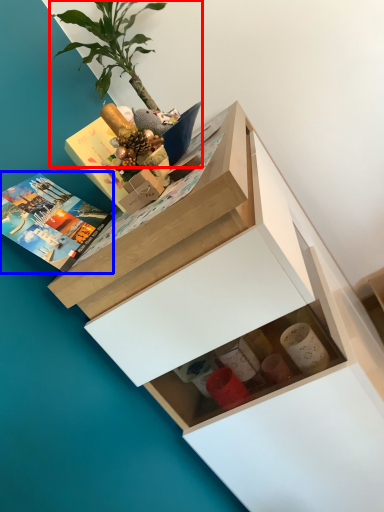
Question: Which point is closer to the camera, houseplant (highlighted by a red box) or book (highlighted by a blue box)?

Choices:
 (A) houseplant
 (B) book

Answer: (B)